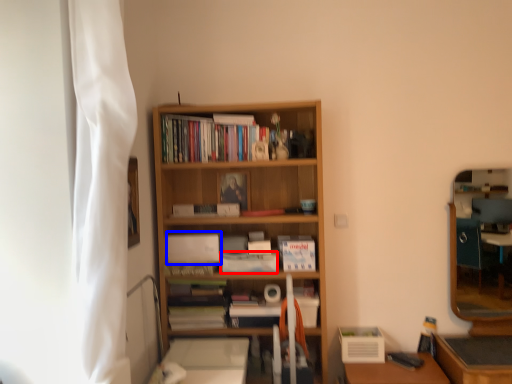
Question: Which of the following is the farthest to the observer, paperback book (highlighted by a red box) or paperback book (highlighted by a blue box)?

Choices:
 (A) paperback book
 (B) paperback book

Answer: (B)